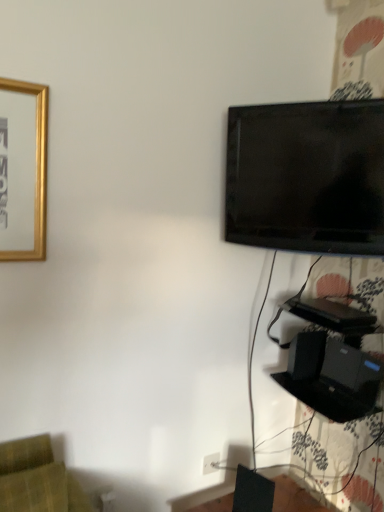
Question: From the image's perspective, is black matte speaker at lower right, which is the first speaker from top to bottom, on black matte speaker at lower right, which ranks as the second speaker in back-to-front order?

Choices:
 (A) no
 (B) yes

Answer: (B)

Question: Is the depth of black matte speaker at lower right, the 1th speaker viewed from the right, greater than that of black matte speaker at lower right, marked as the second speaker in a right-to-left arrangement?

Choices:
 (A) yes
 (B) no

Answer: (A)

Question: Is black matte speaker at lower right, which is the 2th speaker from bottom to top, smaller than black matte speaker at lower right, which appears as the 1th speaker when viewed from the left?

Choices:
 (A) yes
 (B) no

Answer: (B)

Question: Is black matte speaker at lower right, the 1th speaker viewed from the right, facing away from black matte speaker at lower right, which ranks as the first speaker in front-to-back order?

Choices:
 (A) no
 (B) yes

Answer: (A)

Question: Is black matte speaker at lower right, which is the first speaker from top to bottom, outside black matte speaker at lower right, which ranks as the first speaker in bottom-to-top order?

Choices:
 (A) no
 (B) yes

Answer: (B)

Question: Considering their positions, is white plastic electric outlet at lower center located in front of or behind black matte speaker at lower right, which ranks as the first speaker in front-to-back order?

Choices:
 (A) behind
 (B) front

Answer: (A)

Question: From a real-world perspective, is white plastic electric outlet at lower center above or below black matte speaker at lower right, which ranks as the first speaker in front-to-back order?

Choices:
 (A) above
 (B) below

Answer: (B)

Question: Looking at the image, does white plastic electric outlet at lower center seem bigger or smaller compared to black matte speaker at lower right, which ranks as the second speaker in back-to-front order?

Choices:
 (A) small
 (B) big

Answer: (A)

Question: Would you say white plastic electric outlet at lower center is to the left or to the right of black matte speaker at lower right, which ranks as the first speaker in bottom-to-top order, in the picture?

Choices:
 (A) left
 (B) right

Answer: (A)

Question: From a real-world perspective, is black glossy tv at upper right positioned above or below black matte speaker at lower right, placed as the second speaker when sorted from top to bottom?

Choices:
 (A) above
 (B) below

Answer: (A)

Question: Considering the positions of point (231, 217) and point (256, 493), is point (231, 217) closer or farther from the camera than point (256, 493)?

Choices:
 (A) farther
 (B) closer

Answer: (A)

Question: In the image, is black glossy tv at upper right on the left side or the right side of black matte speaker at lower right, which appears as the 1th speaker when viewed from the left?

Choices:
 (A) right
 (B) left

Answer: (A)

Question: From their relative heights in the image, would you say black glossy tv at upper right is taller or shorter than black matte speaker at lower right, which ranks as the first speaker in front-to-back order?

Choices:
 (A) tall
 (B) short

Answer: (A)

Question: From a real-world perspective, is white plastic electric outlet at lower center above or below black matte speaker at lower right, which is the second speaker from left to right?

Choices:
 (A) above
 (B) below

Answer: (B)

Question: Is white plastic electric outlet at lower center inside the boundaries of black matte speaker at lower right, placed as the 1th speaker when sorted from back to front, or outside?

Choices:
 (A) outside
 (B) inside

Answer: (A)